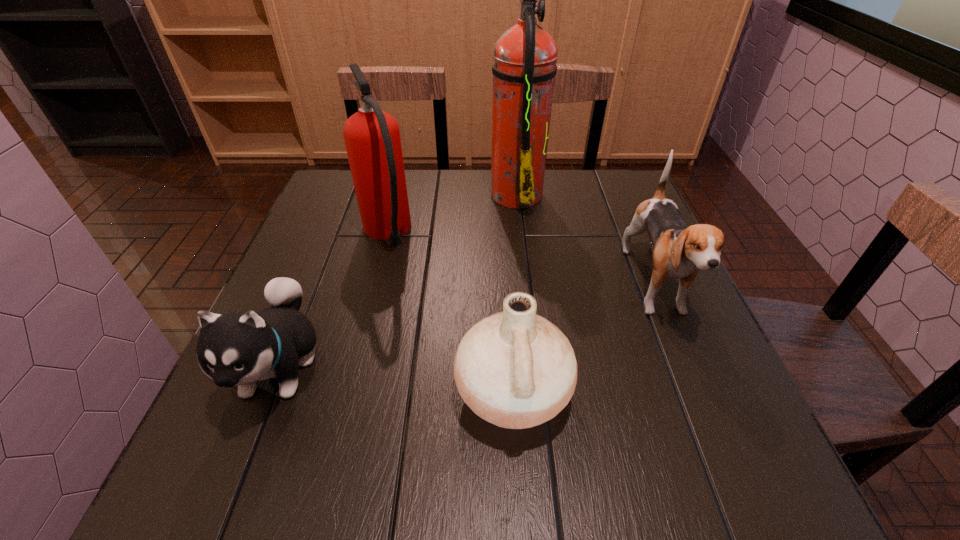
Find the location of a particular element. This screenshot has width=960, height=540. object that is the fourth closest to the rightmost object is located at coordinates (x=239, y=348).

Identify which object is located as the nearest to the right fire extinguisher. Please provide its 2D coordinates. Your answer should be formatted as a tuple, i.e. [(x, y)], where the tuple contains the x and y coordinates of a point satisfying the conditions above.

[(679, 252)]

Locate an element on the screen. blank space that satisfies the following two spatial constraints: 1. at the nozzle of the taller fire extinguisher; 2. at the face of the leftmost object is located at coordinates (535, 366).

You are a GUI agent. You are given a task and a screenshot of the screen. Output one action in this format:
    pyautogui.click(x=<x>, y=<y>)
    Task: Click on the vacant area in the image that satisfies the following two spatial constraints: 1. at the nozzle of the taller fire extinguisher; 2. at the face of the leftmost object
    This screenshot has height=540, width=960.
    Given the screenshot: What is the action you would take?
    pyautogui.click(x=535, y=366)